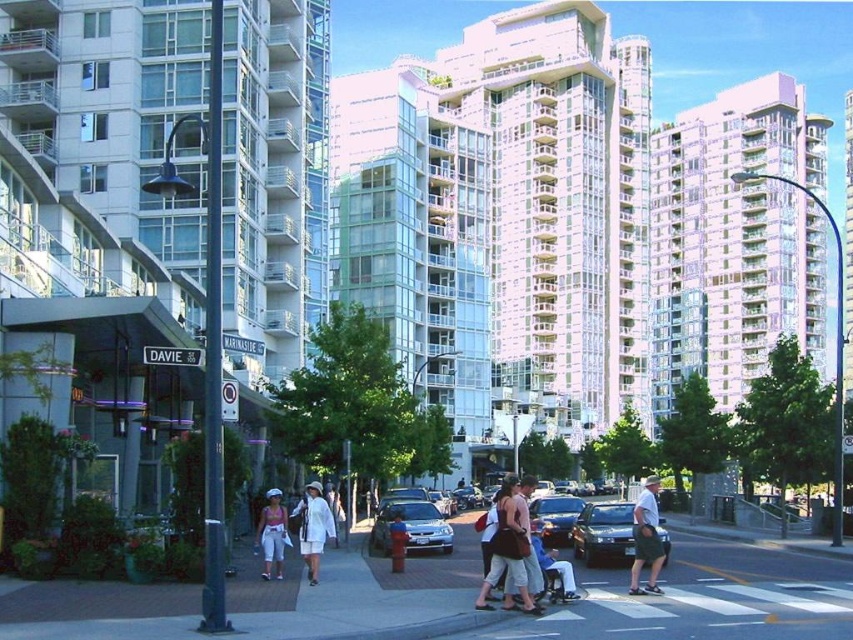
You are a delivery person who needs to park your small van between the shiny black sedan at center and the shiny metallic sedan at center. Which sedan should you place your van next to if you want to maximize the space available for your vehicle?

You should place your van next to the shiny metallic sedan at center because it is larger, leaving more space between it and the shiny black sedan at center. The shiny black sedan at center has a smaller size compared to the shiny metallic sedan at center, so positioning your van next to the larger sedan would provide more room.

You are a delivery person who needs to quickly move your black rubber skateboard at lower center to the other side of the road without obstructing the silver metallic sedan at center. Can you do this safely?

The silver metallic sedan at center is further to the viewer than the black rubber skateboard at lower center, so the skateboard is closer to the road. Therefore, you can move the black rubber skateboard at lower center to the other side of the road safely without obstructing the sedan.